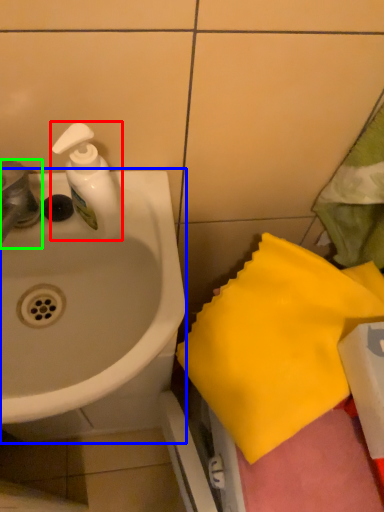
Question: Considering the real-world distances, which object is farthest from soap dispenser (highlighted by a red box)? sink (highlighted by a blue box) or tap (highlighted by a green box)?

Choices:
 (A) sink
 (B) tap

Answer: (A)